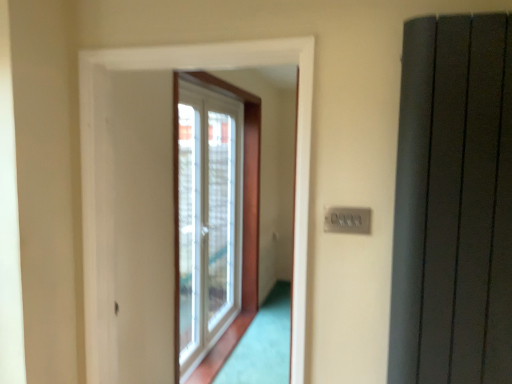
Question: Based on their sizes in the image, would you say white plastic window at center is bigger or smaller than gray plastic switch at upper right?

Choices:
 (A) big
 (B) small

Answer: (A)

Question: In terms of height, does white plastic window at center look taller or shorter compared to gray plastic switch at upper right?

Choices:
 (A) tall
 (B) short

Answer: (A)

Question: Which is nearer to the gray plastic switch at upper right?

Choices:
 (A) white plastic window at center
 (B) matte gray radiator at right

Answer: (B)

Question: Estimate the real-world distances between objects in this image. Which object is farther from the gray plastic switch at upper right?

Choices:
 (A) white plastic window at center
 (B) matte gray radiator at right

Answer: (A)